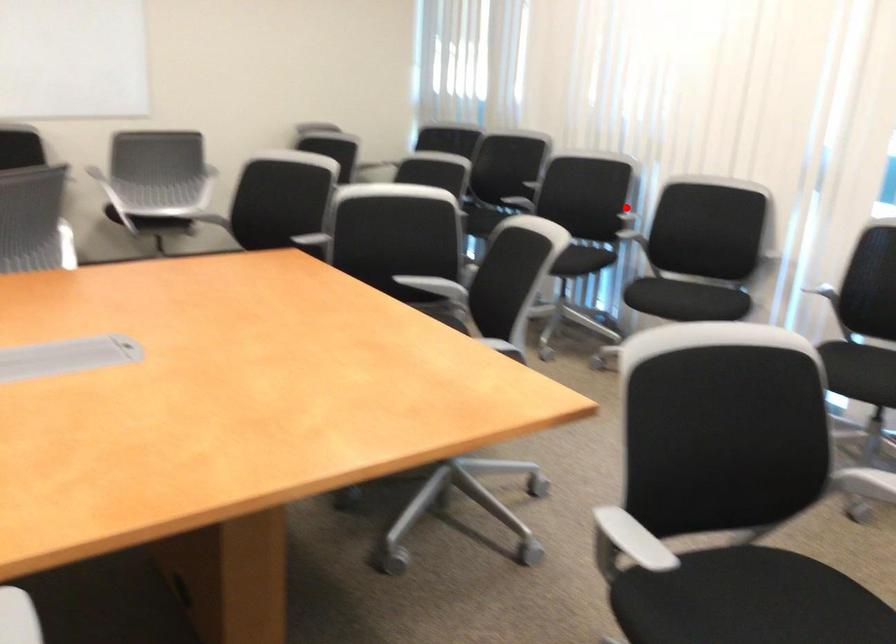
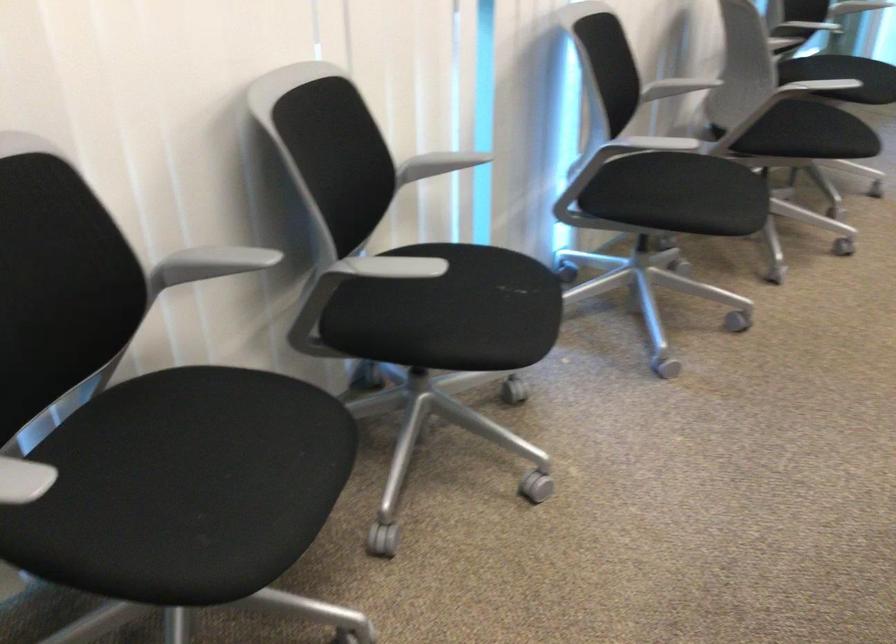
Question: I am providing you with two images of the same scene from different viewpoints. Image1 has a red point marked. In image2, the corresponding 3D location appears at what relative position? Reply with the corresponding letter.

Choices:
 (A) Closer
 (B) Farther

Answer: (A)